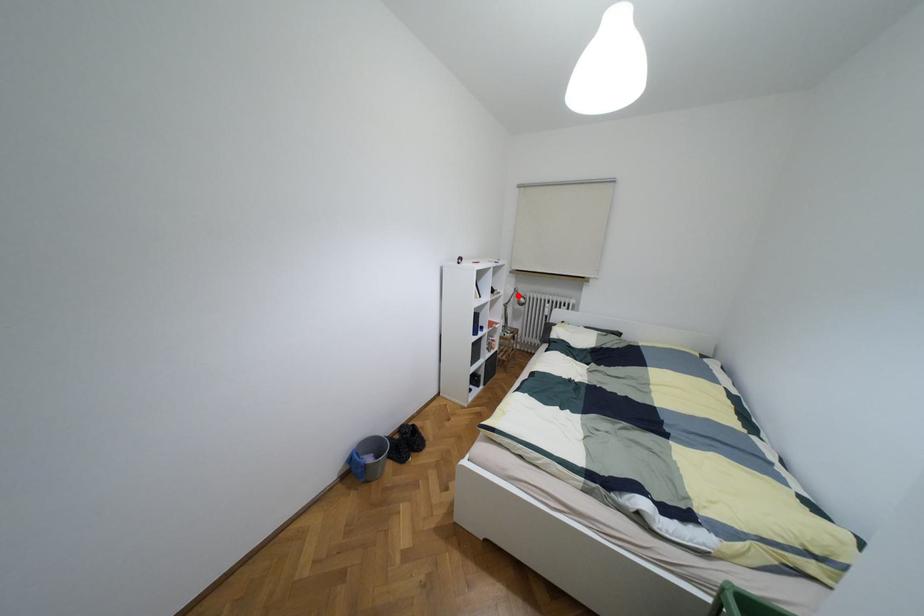
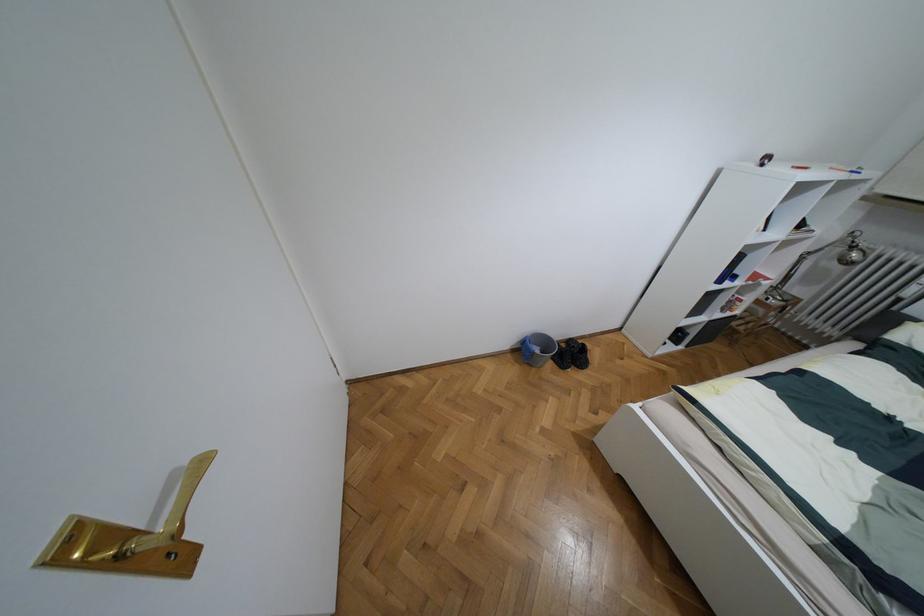
Locate, in the second image, the point that corresponds to the highlighted location in the first image.

(852, 246)